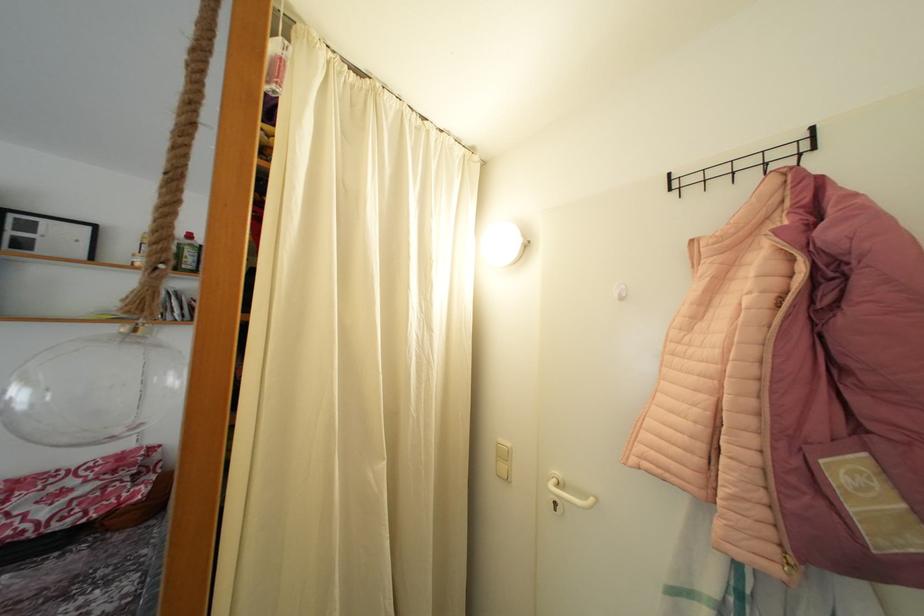
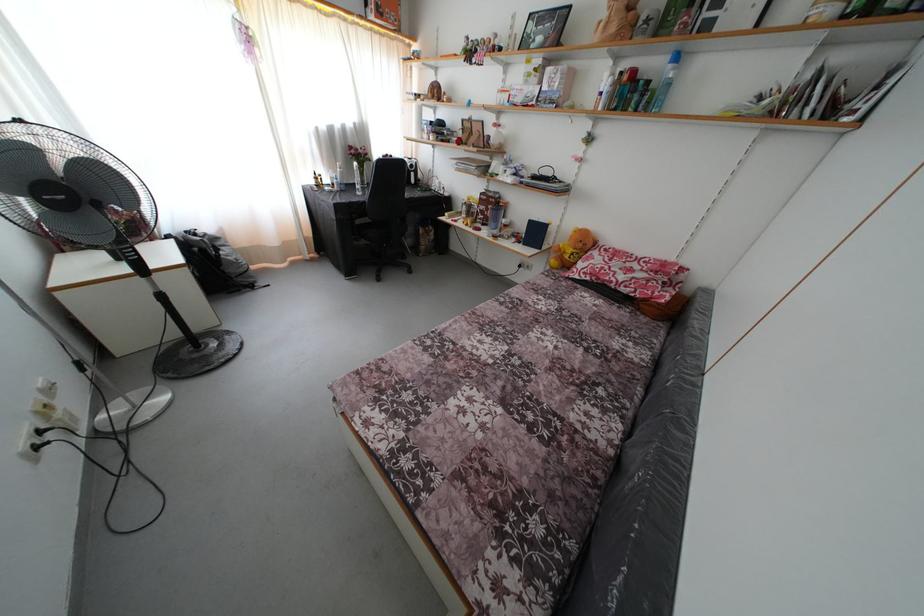
Find the pixel in the second image that matches (x=155, y=561) in the first image.

(663, 353)